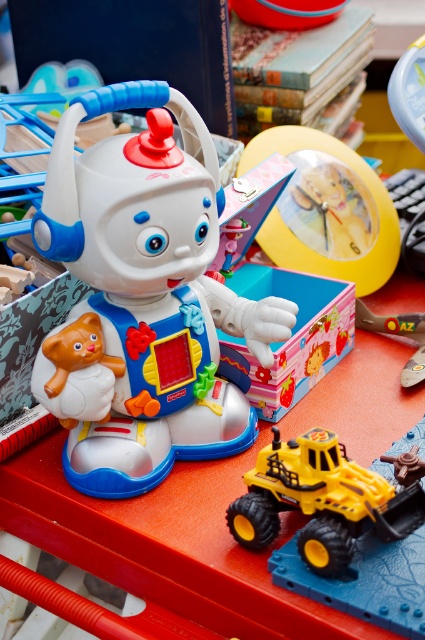
Question: Is yellow rubber toy truck at lower center below matte plastic clock at center?

Choices:
 (A) yes
 (B) no

Answer: (A)

Question: Which object is the closest to the matte plastic clock at center?

Choices:
 (A) plastic toy robot at center
 (B) yellow rubber toy truck at lower center

Answer: (A)

Question: Does plastic toy robot at center appear on the right side of matte plastic clock at center?

Choices:
 (A) yes
 (B) no

Answer: (B)

Question: Can you confirm if yellow rubber toy truck at lower center is thinner than matte plastic clock at center?

Choices:
 (A) yes
 (B) no

Answer: (A)

Question: Among these objects, which one is nearest to the camera?

Choices:
 (A) plastic toy robot at center
 (B) yellow rubber toy truck at lower center
 (C) yellow plastic clock at center
 (D) matte plastic clock at center

Answer: (B)

Question: Based on their relative distances, which object is nearer to the matte plastic clock at center?

Choices:
 (A) plastic toy robot at center
 (B) yellow rubber toy truck at lower center
 (C) yellow plastic clock at center

Answer: (C)